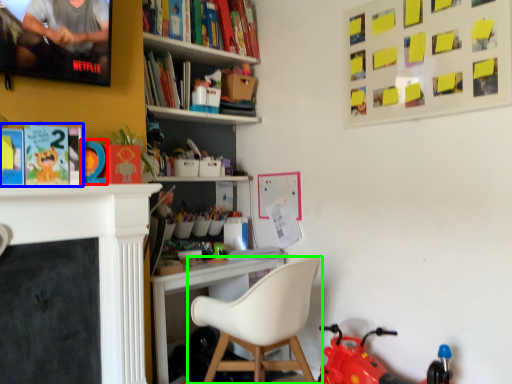
Question: Which object is the farthest from toy (highlighted by a red box)? Choose among these: book (highlighted by a blue box) or chair (highlighted by a green box).

Choices:
 (A) book
 (B) chair

Answer: (B)